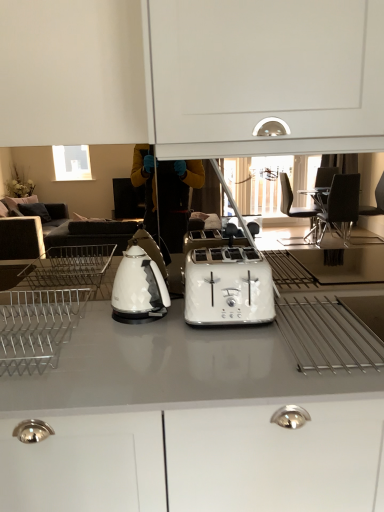
The width and height of the screenshot is (384, 512). I want to click on free spot above white glossy countertop at center (from a real-world perspective), so click(174, 338).